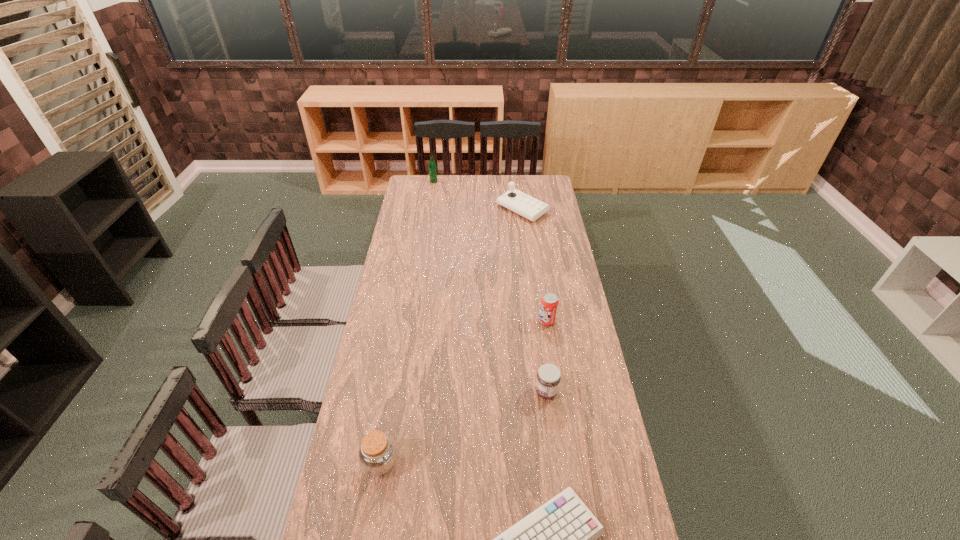
The height and width of the screenshot is (540, 960). Find the location of `blank region between the third farthest object and the bottle`. blank region between the third farthest object and the bottle is located at coordinates (491, 251).

Find the location of a particular element. The height and width of the screenshot is (540, 960). blank region between the bottle and the jam is located at coordinates (490, 287).

Choose which object is the nearest neighbor to the third nearest object. Please provide its 2D coordinates. Your answer should be formatted as a tuple, i.e. [(x, y)], where the tuple contains the x and y coordinates of a point satisfying the conditions above.

[(549, 302)]

Image resolution: width=960 pixels, height=540 pixels. What are the coordinates of `object identified as the fourth closest to the joystick` in the screenshot? It's located at (377, 454).